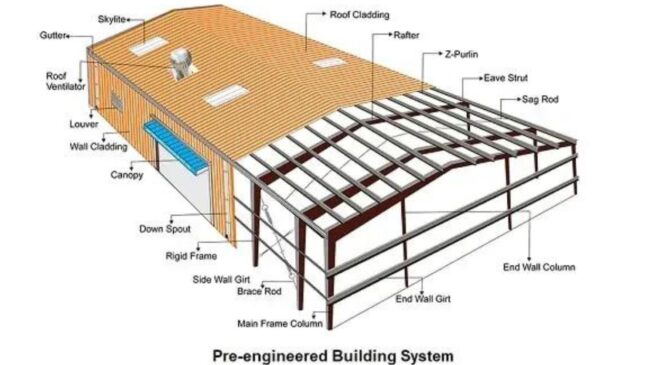
The height and width of the screenshot is (365, 650). I want to click on sheets, so click(x=281, y=114).